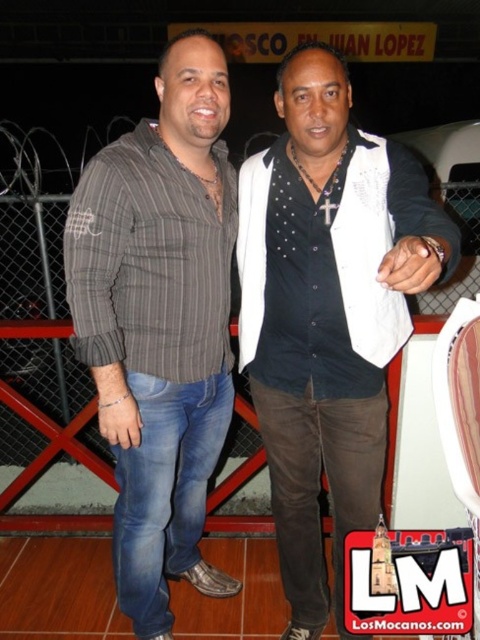
Does point (388, 321) lie behind point (115, 396)?

Yes, point (388, 321) is behind point (115, 396).

This screenshot has height=640, width=480. What do you see at coordinates (327, 312) in the screenshot? I see `white textured vest at center` at bounding box center [327, 312].

Locate an element on the screen. white textured vest at center is located at coordinates (327, 312).